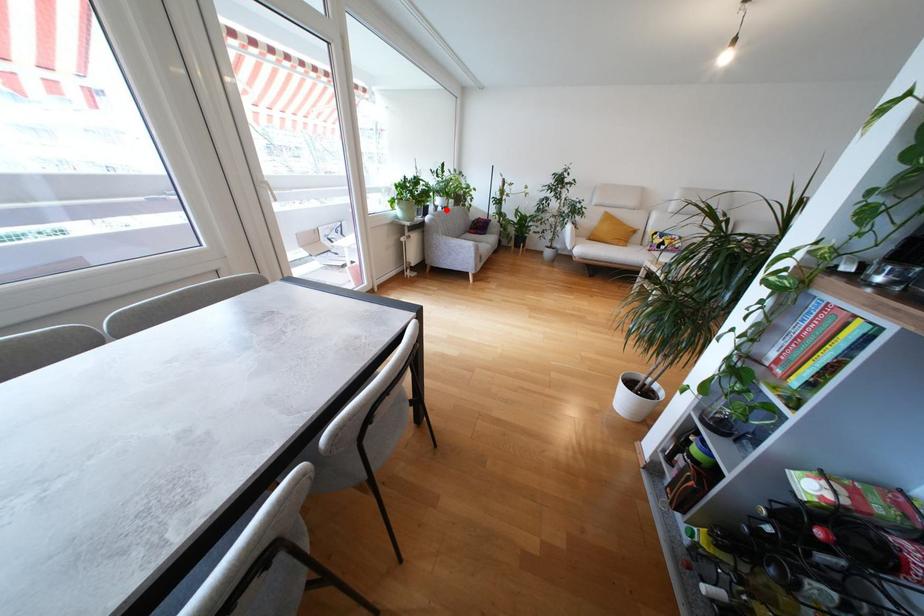
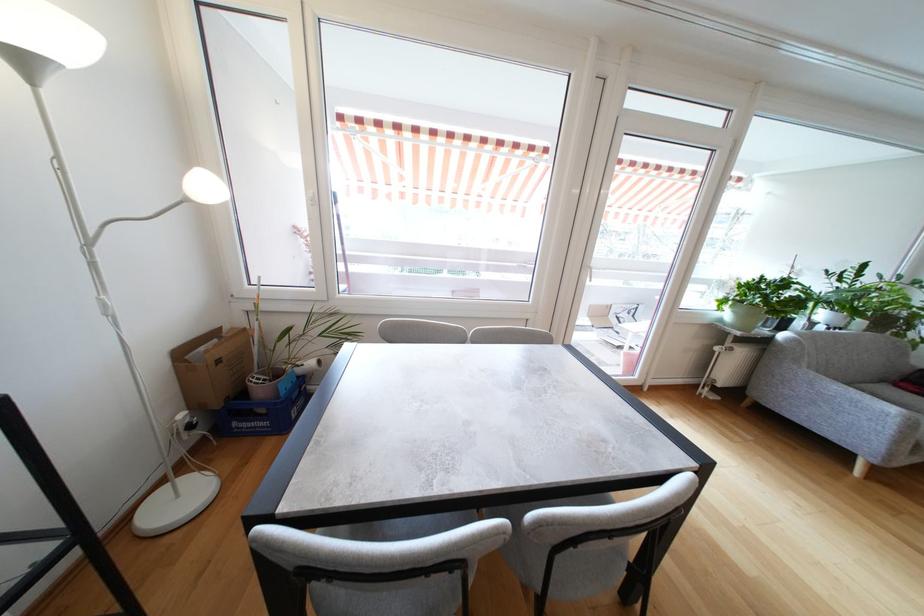
Question: A red point is marked in image1. In image2, is the corresponding 3D point closer to the camera or farther? Reply with the corresponding letter.

Choices:
 (A) The corresponding 3D point is closer.
 (B) The corresponding 3D point is farther.

Answer: (B)